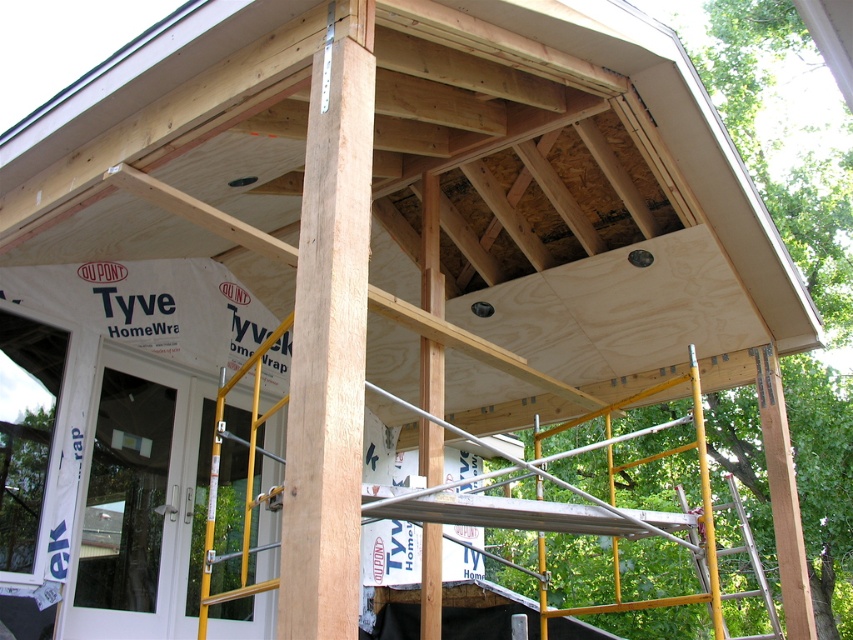
Question: Does natural wood post at center come in front of yellow metal scaffolding at upper center?

Choices:
 (A) no
 (B) yes

Answer: (B)

Question: Is natural wood post at center thinner than yellow metal scaffolding at upper center?

Choices:
 (A) no
 (B) yes

Answer: (B)

Question: Among these points, which one is nearest to the camera?

Choices:
 (A) (292, 433)
 (B) (703, 502)

Answer: (A)

Question: Can you confirm if natural wood post at center is positioned to the left of yellow metal scaffolding at upper center?

Choices:
 (A) no
 (B) yes

Answer: (B)

Question: Which object is closer to the camera taking this photo?

Choices:
 (A) yellow metal scaffolding at upper center
 (B) natural wood post at center

Answer: (B)